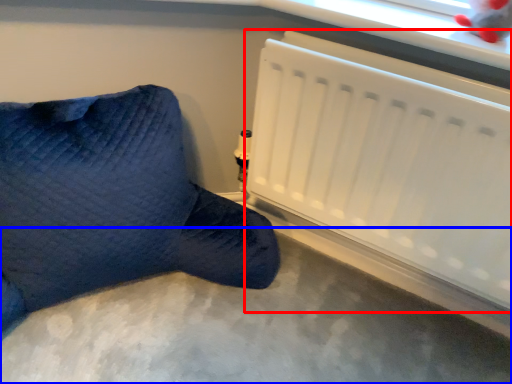
Question: Among these objects, which one is farthest to the camera, radiator (highlighted by a red box) or concrete (highlighted by a blue box)?

Choices:
 (A) radiator
 (B) concrete

Answer: (A)